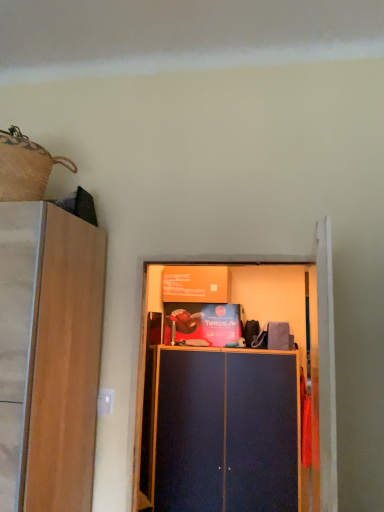
Question: Is matte dark blue cabinet at center at the right side of blue matte cupboard at center?

Choices:
 (A) yes
 (B) no

Answer: (A)

Question: Considering the relative sizes of matte dark blue cabinet at center and blue matte cupboard at center in the image provided, is matte dark blue cabinet at center thinner than blue matte cupboard at center?

Choices:
 (A) no
 (B) yes

Answer: (A)

Question: Can you confirm if matte dark blue cabinet at center is positioned to the left of blue matte cupboard at center?

Choices:
 (A) no
 (B) yes

Answer: (A)

Question: Is matte dark blue cabinet at center shorter than blue matte cupboard at center?

Choices:
 (A) no
 (B) yes

Answer: (A)

Question: Considering the relative sizes of matte dark blue cabinet at center and blue matte cupboard at center in the image provided, is matte dark blue cabinet at center taller than blue matte cupboard at center?

Choices:
 (A) yes
 (B) no

Answer: (A)

Question: Can you confirm if matte dark blue cabinet at center is bigger than blue matte cupboard at center?

Choices:
 (A) no
 (B) yes

Answer: (B)

Question: Is blue matte cupboard at center located outside matte dark blue cabinet at center?

Choices:
 (A) no
 (B) yes

Answer: (B)

Question: From a real-world perspective, is blue matte cupboard at center on top of matte dark blue cabinet at center?

Choices:
 (A) yes
 (B) no

Answer: (A)

Question: Is blue matte cupboard at center far from matte dark blue cabinet at center?

Choices:
 (A) yes
 (B) no

Answer: (B)

Question: From a real-world perspective, is blue matte cupboard at center beneath matte dark blue cabinet at center?

Choices:
 (A) yes
 (B) no

Answer: (B)

Question: Is blue matte cupboard at center oriented towards matte dark blue cabinet at center?

Choices:
 (A) yes
 (B) no

Answer: (B)

Question: Is blue matte cupboard at center smaller than matte dark blue cabinet at center?

Choices:
 (A) yes
 (B) no

Answer: (A)

Question: Is point (211, 487) closer or farther from the camera than point (319, 233)?

Choices:
 (A) farther
 (B) closer

Answer: (A)